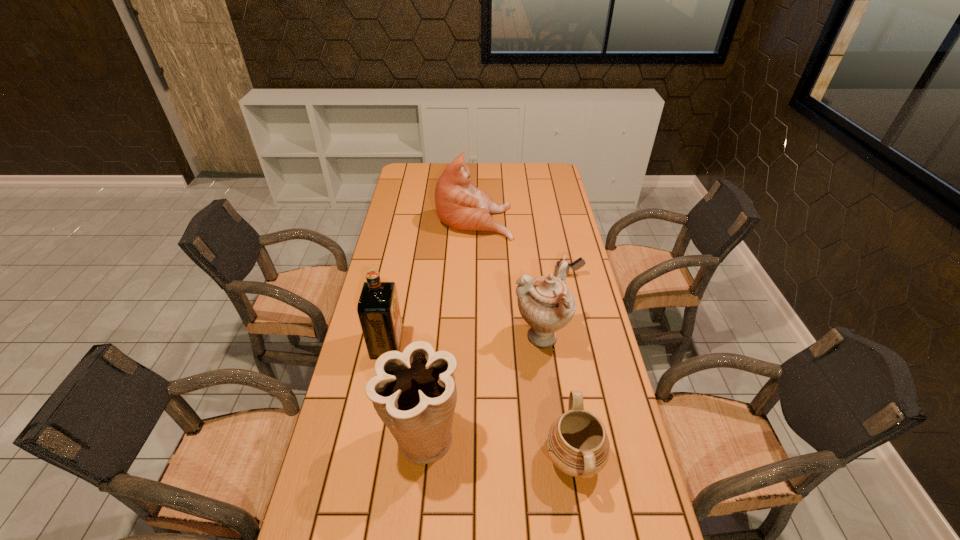
This screenshot has width=960, height=540. In order to click on vacant area situated 0.220m on the left of the farthest urn in this screenshot , I will do `click(444, 339)`.

This screenshot has height=540, width=960. I want to click on vacant space located 0.190m on the front-facing side of the shortest urn, so click(468, 458).

The image size is (960, 540). What are the coordinates of `free space located on the front-facing side of the shortest urn` in the screenshot? It's located at (484, 458).

Where is `vacant area situated 0.120m on the front-facing side of the shortest urn`? vacant area situated 0.120m on the front-facing side of the shortest urn is located at coordinates (495, 458).

You are a GUI agent. You are given a task and a screenshot of the screen. Output one action in this format:
    pyautogui.click(x=<x>, y=<y>)
    Task: Click on the vacant region located on the left of the shortest object
    The height and width of the screenshot is (540, 960).
    Given the screenshot: What is the action you would take?
    pyautogui.click(x=484, y=275)

At what (x,y) coordinates should I click in order to perform the action: click on liquor present at the left edge. Please return your answer as a coordinate pair (x, y). This screenshot has width=960, height=540. Looking at the image, I should click on (378, 309).

You are a GUI agent. You are given a task and a screenshot of the screen. Output one action in this format:
    pyautogui.click(x=<x>, y=<y>)
    Task: Click on the urn that is at the left edge
    This screenshot has width=960, height=540.
    Given the screenshot: What is the action you would take?
    pyautogui.click(x=414, y=393)

I want to click on igniter present at the right edge, so click(580, 262).

In order to click on free space at the far edge of the desktop in this screenshot , I will do `click(486, 178)`.

I want to click on vacant area at the left edge, so click(386, 280).